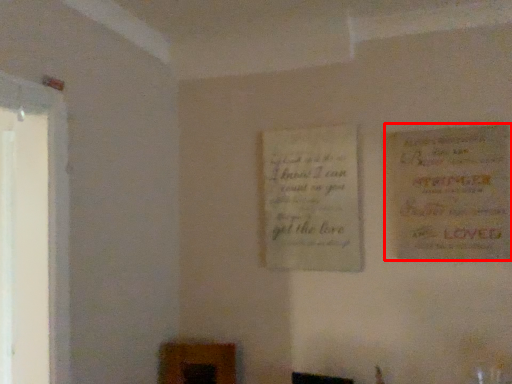
Question: From the image's perspective, what is the correct spatial relationship of poster (annotated by the red box) in relation to poster?

Choices:
 (A) below
 (B) above

Answer: (B)